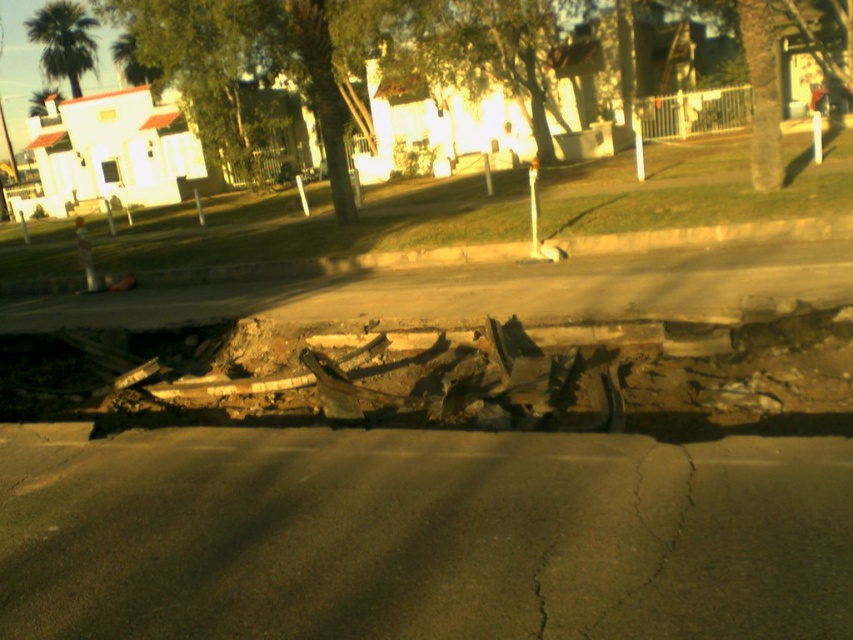
Question: Among these points, which one is nearest to the camera?

Choices:
 (A) (119, 330)
 (B) (57, 289)

Answer: (A)

Question: Which of the following is the farthest from the observer?

Choices:
 (A) brown concrete curb at upper center
 (B) rusty concrete rubble at center

Answer: (A)

Question: From the image, what is the correct spatial relationship of rusty concrete rubble at center in relation to brown concrete curb at upper center?

Choices:
 (A) above
 (B) below

Answer: (B)

Question: Does rusty concrete rubble at center have a larger size compared to brown concrete curb at upper center?

Choices:
 (A) yes
 (B) no

Answer: (A)

Question: Is rusty concrete rubble at center to the left of brown concrete curb at upper center from the viewer's perspective?

Choices:
 (A) yes
 (B) no

Answer: (B)

Question: Which object is farther from the camera taking this photo?

Choices:
 (A) brown concrete curb at upper center
 (B) rusty concrete rubble at center

Answer: (A)